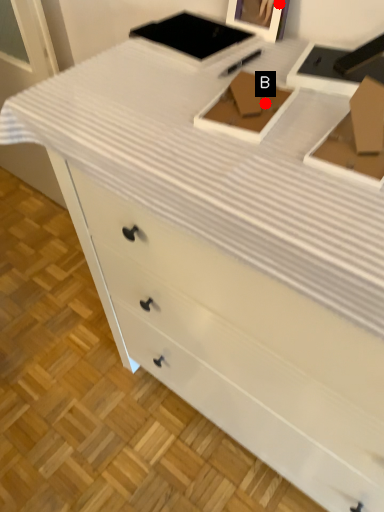
Question: Two points are circled on the image, labeled by A and B beside each circle. Which point is farther from the camera taking this photo?

Choices:
 (A) A is further
 (B) B is further

Answer: (A)